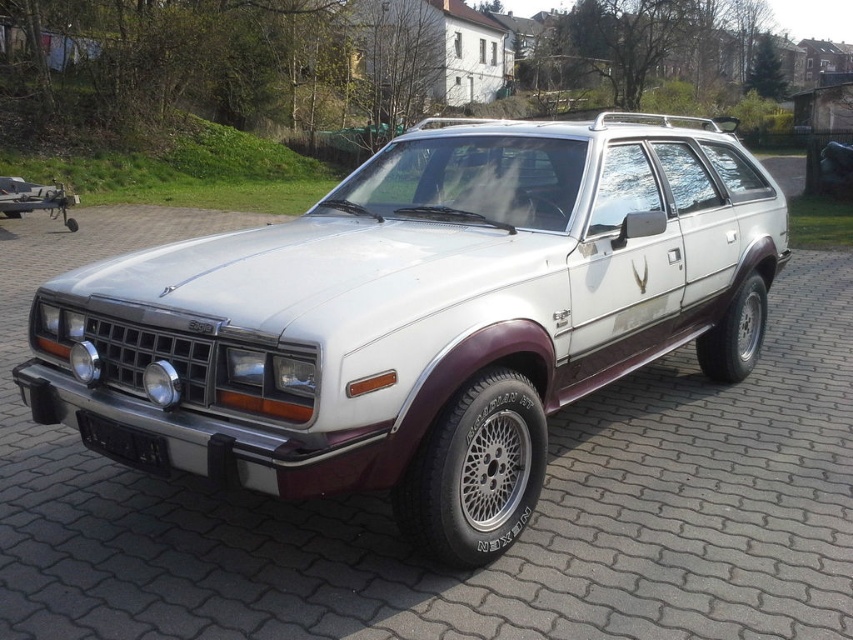
Question: Is white matte station wagon at center to the left of gray concrete driveway at center from the viewer's perspective?

Choices:
 (A) no
 (B) yes

Answer: (B)

Question: Which point is farther to the camera?

Choices:
 (A) (776, 164)
 (B) (258, 486)

Answer: (A)

Question: Where is black plastic license plate at lower center located in relation to gray concrete driveway at center in the image?

Choices:
 (A) right
 (B) left

Answer: (B)

Question: Which of the following is the closest to the observer?

Choices:
 (A) (107, 445)
 (B) (306, 481)
 (C) (799, 163)

Answer: (B)

Question: Among these objects, which one is farthest from the camera?

Choices:
 (A) gray concrete driveway at center
 (B) white matte station wagon at center
 (C) black plastic license plate at lower center

Answer: (A)

Question: Can you confirm if white matte station wagon at center is bigger than gray concrete driveway at center?

Choices:
 (A) no
 (B) yes

Answer: (A)